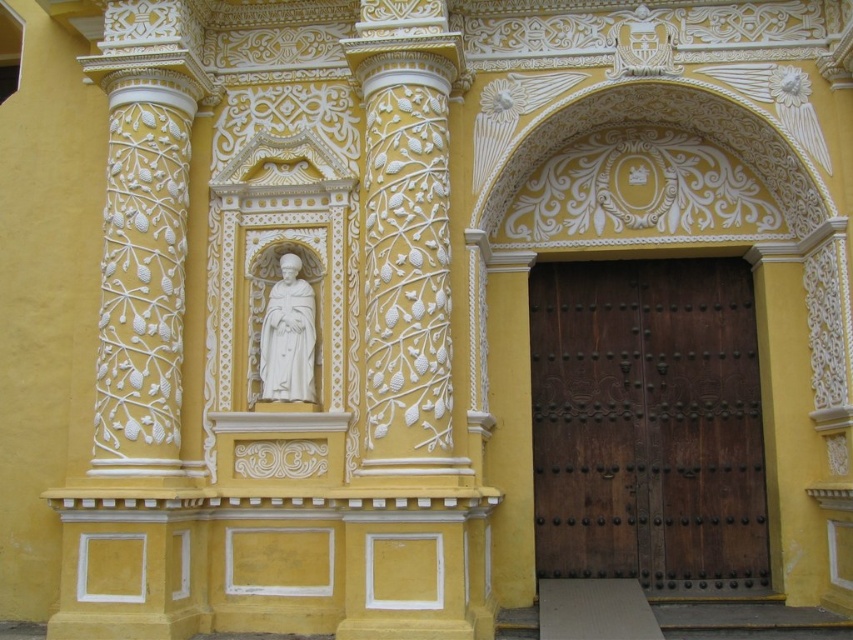
Question: Considering the relative positions of dark brown wood door at center and white marble statue at center in the image provided, where is dark brown wood door at center located with respect to white marble statue at center?

Choices:
 (A) below
 (B) above

Answer: (A)

Question: Observing the image, what is the correct spatial positioning of dark brown wood door at center in reference to white marble statue at center?

Choices:
 (A) right
 (B) left

Answer: (A)

Question: Which of the following is the farthest from the observer?

Choices:
 (A) (264, 372)
 (B) (556, 566)

Answer: (B)

Question: Is dark brown wood door at center in front of white marble statue at center?

Choices:
 (A) no
 (B) yes

Answer: (A)